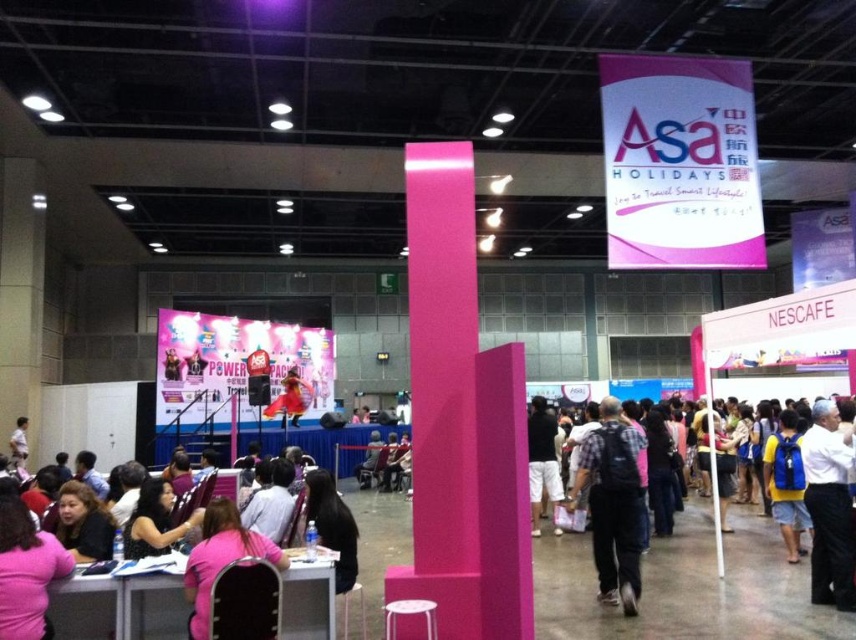
Measure the distance between white shirt at center and blue backpack at right.

They are 36.15 inches apart.

Is white shirt at center taller than blue backpack at right?

Correct, white shirt at center is much taller as blue backpack at right.

The width and height of the screenshot is (856, 640). What are the coordinates of `white shirt at center` in the screenshot? It's located at (829, 508).

Does blue backpack at right have a smaller size compared to black fabric backpack at center?

Yes.

Which is more to the left, blue backpack at right or black fabric backpack at center?

black fabric backpack at center is more to the left.

Is point (786, 484) farther from viewer compared to point (538, 515)?

That is False.

Identify the location of blue backpack at right. (786, 483).

Between plaid shirt at center and plaid fabric shirt at center, which one is positioned higher?

plaid fabric shirt at center is above.

Based on the photo, is plaid shirt at center positioned behind plaid fabric shirt at center?

No, plaid shirt at center is closer to the viewer.

Is point (593, 577) positioned after point (589, 458)?

Yes, it is.

You are a GUI agent. You are given a task and a screenshot of the screen. Output one action in this format:
    pyautogui.click(x=<x>, y=<y>)
    Task: Click on the plaid shirt at center
    
    Given the screenshot: What is the action you would take?
    pyautogui.click(x=688, y=579)